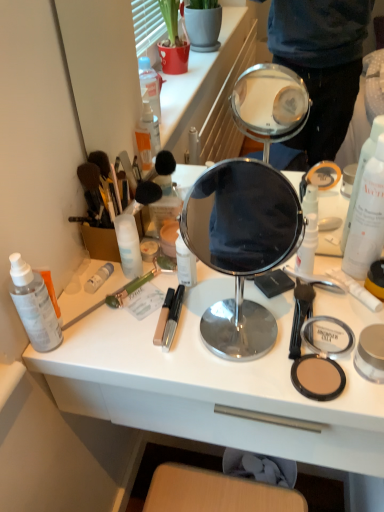
At what (x,y) coordinates should I click in order to perform the action: click on empty space that is ontop of white plastic desk at center (from a real-world perspective). Please return your answer as a coordinate pair (x, y). The image size is (384, 512). Looking at the image, I should click on (232, 310).